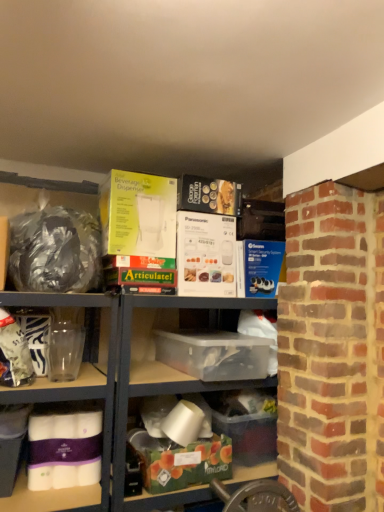
Question: Does clear plastic container at center appear on the left side of transparent plastic box at center, marked as the 2th box in a top-to-bottom arrangement?

Choices:
 (A) yes
 (B) no

Answer: (A)

Question: Does clear plastic container at center appear on the right side of transparent plastic box at center, the fourth box from the bottom?

Choices:
 (A) no
 (B) yes

Answer: (A)

Question: From the image's perspective, is clear plastic container at center on transparent plastic box at center, marked as the 2th box in a top-to-bottom arrangement?

Choices:
 (A) yes
 (B) no

Answer: (B)

Question: Considering the relative sizes of clear plastic container at center and transparent plastic box at center, the fourth box from the bottom, in the image provided, is clear plastic container at center taller than transparent plastic box at center, the fourth box from the bottom,?

Choices:
 (A) no
 (B) yes

Answer: (B)

Question: Considering the relative sizes of clear plastic container at center and transparent plastic box at center, marked as the 2th box in a top-to-bottom arrangement, in the image provided, is clear plastic container at center bigger than transparent plastic box at center, marked as the 2th box in a top-to-bottom arrangement,?

Choices:
 (A) no
 (B) yes

Answer: (B)

Question: Could you tell me if clear plastic container at center is facing transparent plastic box at center, marked as the 2th box in a top-to-bottom arrangement?

Choices:
 (A) yes
 (B) no

Answer: (A)

Question: From a real-world perspective, is translucent plastic container at center, arranged as the fifth box when viewed from the top, located beneath purple matte tissue at lower left, the third box from the top?

Choices:
 (A) yes
 (B) no

Answer: (A)

Question: Considering the relative positions of translucent plastic container at center, the 1th box ordered from the bottom, and purple matte tissue at lower left, the 3th box positioned from the bottom, in the image provided, is translucent plastic container at center, the 1th box ordered from the bottom, to the left of purple matte tissue at lower left, the 3th box positioned from the bottom, from the viewer's perspective?

Choices:
 (A) no
 (B) yes

Answer: (A)

Question: Is translucent plastic container at center, arranged as the fifth box when viewed from the top, not close to purple matte tissue at lower left, the third box from the top?

Choices:
 (A) no
 (B) yes

Answer: (A)

Question: Is translucent plastic container at center, the 1th box ordered from the bottom, positioned with its back to purple matte tissue at lower left, the third box from the top?

Choices:
 (A) yes
 (B) no

Answer: (B)

Question: Can you confirm if translucent plastic container at center, arranged as the fifth box when viewed from the top, is taller than purple matte tissue at lower left, the third box from the top?

Choices:
 (A) no
 (B) yes

Answer: (A)

Question: Is translucent plastic container at center, arranged as the fifth box when viewed from the top, facing towards purple matte tissue at lower left, the 3th box positioned from the bottom?

Choices:
 (A) no
 (B) yes

Answer: (A)

Question: Considering the relative positions of translucent plastic container at center, arranged as the fifth box when viewed from the top, and yellow cardboard beverage dispenser at upper center, the 5th box ordered from the bottom, in the image provided, is translucent plastic container at center, arranged as the fifth box when viewed from the top, to the right of yellow cardboard beverage dispenser at upper center, the 5th box ordered from the bottom, from the viewer's perspective?

Choices:
 (A) no
 (B) yes

Answer: (B)